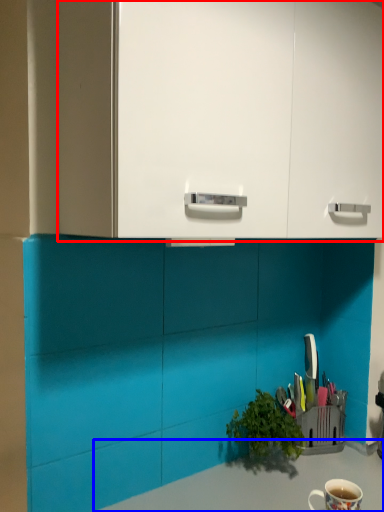
Question: Among these objects, which one is farthest to the camera, dresser (highlighted by a red box) or counter top (highlighted by a blue box)?

Choices:
 (A) dresser
 (B) counter top

Answer: (B)